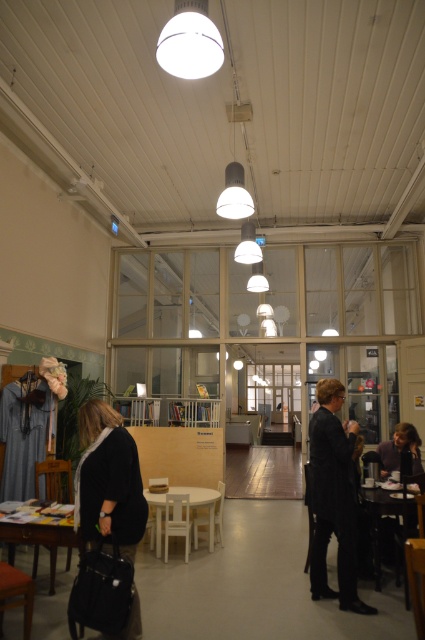
Does white matte table at center appear over black glossy table at lower right?

Incorrect, white matte table at center is not positioned above black glossy table at lower right.

Is white matte table at center wider than black glossy table at lower right?

Indeed, white matte table at center has a greater width compared to black glossy table at lower right.

Identify the location of white matte table at center. (201, 502).

Does velvet black coat at lower left have a greater width compared to black glossy table at lower right?

Yes.

This screenshot has height=640, width=425. Find the location of `velvet black coat at lower left`. velvet black coat at lower left is located at coordinates (107, 483).

Which is below, black pinstripe suit at right or white matte table at center?

white matte table at center

Does point (354, 579) come in front of point (184, 490)?

Yes, point (354, 579) is closer to viewer.

Between point (339, 460) and point (158, 531), which one is positioned behind?

The point (158, 531) is behind.

Where is `black pinstripe suit at right`? This screenshot has width=425, height=640. black pinstripe suit at right is located at coordinates (334, 497).